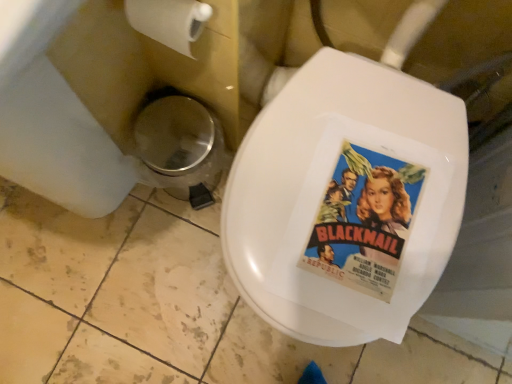
Question: Is white matte toilet paper at upper left taller than vintage paper movie poster at center?

Choices:
 (A) yes
 (B) no

Answer: (A)

Question: Is white matte toilet paper at upper left looking in the opposite direction of vintage paper movie poster at center?

Choices:
 (A) no
 (B) yes

Answer: (A)

Question: Is white matte toilet paper at upper left touching vintage paper movie poster at center?

Choices:
 (A) no
 (B) yes

Answer: (A)

Question: Can you confirm if white matte toilet paper at upper left is positioned to the right of vintage paper movie poster at center?

Choices:
 (A) yes
 (B) no

Answer: (B)

Question: From a real-world perspective, does white matte toilet paper at upper left stand above vintage paper movie poster at center?

Choices:
 (A) no
 (B) yes

Answer: (B)

Question: Considering the relative sizes of white matte toilet paper at upper left and vintage paper movie poster at center in the image provided, is white matte toilet paper at upper left shorter than vintage paper movie poster at center?

Choices:
 (A) no
 (B) yes

Answer: (A)

Question: Could you tell me if vintage paper movie poster at center is turned towards white matte toilet paper at upper left?

Choices:
 (A) yes
 (B) no

Answer: (B)

Question: Is the surface of vintage paper movie poster at center in direct contact with white matte toilet paper at upper left?

Choices:
 (A) no
 (B) yes

Answer: (A)

Question: Is vintage paper movie poster at center to the left of white matte toilet paper at upper left from the viewer's perspective?

Choices:
 (A) yes
 (B) no

Answer: (B)

Question: From the image's perspective, is vintage paper movie poster at center above white matte toilet paper at upper left?

Choices:
 (A) yes
 (B) no

Answer: (B)

Question: From a real-world perspective, is vintage paper movie poster at center located higher than white matte toilet paper at upper left?

Choices:
 (A) yes
 (B) no

Answer: (B)

Question: Considering the relative sizes of vintage paper movie poster at center and white matte toilet paper at upper left in the image provided, is vintage paper movie poster at center shorter than white matte toilet paper at upper left?

Choices:
 (A) yes
 (B) no

Answer: (A)

Question: Considering the relative sizes of metallic silver trash can at lower left and white matte toilet paper at upper left in the image provided, is metallic silver trash can at lower left smaller than white matte toilet paper at upper left?

Choices:
 (A) no
 (B) yes

Answer: (A)